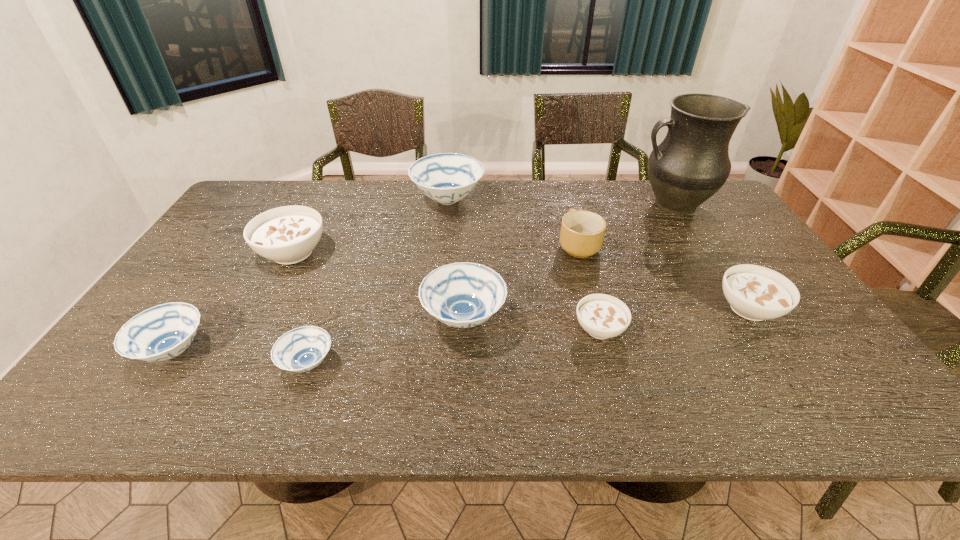
Identify which soup bowl is the fifth closest to the second white soup bowl from left to right. Please provide its 2D coordinates. Your answer should be formatted as a tuple, i.e. [(x, y)], where the tuple contains the x and y coordinates of a point satisfying the conditions above.

[(287, 235)]

Locate an element on the screen. the closest blue soup bowl to the leftmost white soup bowl is located at coordinates (163, 332).

The height and width of the screenshot is (540, 960). Find the location of `blue soup bowl that is the third closest to the third smallest blue soup bowl`. blue soup bowl that is the third closest to the third smallest blue soup bowl is located at coordinates (163, 332).

Locate which white soup bowl is the closest to the biggest blue soup bowl. Please provide its 2D coordinates. Your answer should be formatted as a tuple, i.e. [(x, y)], where the tuple contains the x and y coordinates of a point satisfying the conditions above.

[(287, 235)]

Point out which white soup bowl is positioned as the second nearest to the third smallest blue soup bowl. Please provide its 2D coordinates. Your answer should be formatted as a tuple, i.e. [(x, y)], where the tuple contains the x and y coordinates of a point satisfying the conditions above.

[(287, 235)]

I want to click on free spot that satisfies the following two spatial constraints: 1. on the handle side of the black pitcher; 2. on the front side of the second farthest soup bowl, so click(703, 253).

Locate an element on the screen. The width and height of the screenshot is (960, 540). free space that satisfies the following two spatial constraints: 1. on the back side of the farthest white soup bowl; 2. on the right side of the farthest blue soup bowl is located at coordinates tap(321, 199).

The height and width of the screenshot is (540, 960). I want to click on vacant point that satisfies the following two spatial constraints: 1. on the front side of the third biggest blue soup bowl; 2. on the left side of the smallest blue soup bowl, so click(165, 363).

In order to click on vacant space that satisfies the following two spatial constraints: 1. on the back side of the farthest white soup bowl; 2. on the right side of the leftmost blue soup bowl in this screenshot , I will do `click(239, 253)`.